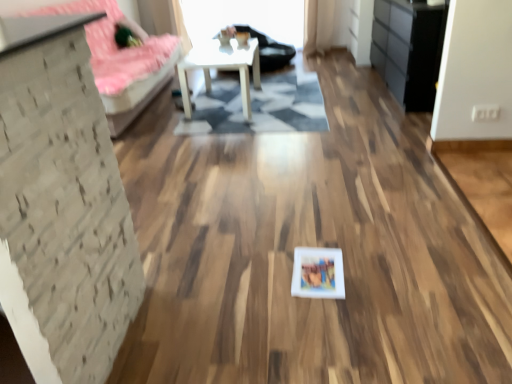
Question: Are geometric rug at center and black matte dresser at right making contact?

Choices:
 (A) yes
 (B) no

Answer: (B)

Question: From the image's perspective, does geometric rug at center appear lower than black matte dresser at right?

Choices:
 (A) yes
 (B) no

Answer: (A)

Question: Considering the relative sizes of geometric rug at center and black matte dresser at right in the image provided, is geometric rug at center taller than black matte dresser at right?

Choices:
 (A) yes
 (B) no

Answer: (B)

Question: Is geometric rug at center looking in the opposite direction of black matte dresser at right?

Choices:
 (A) no
 (B) yes

Answer: (A)

Question: Does geometric rug at center have a greater width compared to black matte dresser at right?

Choices:
 (A) yes
 (B) no

Answer: (A)

Question: Is black matte dresser at right a part of geometric rug at center?

Choices:
 (A) yes
 (B) no

Answer: (B)

Question: Does geometric rug at center appear on the right side of matte white picture frame at center?

Choices:
 (A) no
 (B) yes

Answer: (A)

Question: Can you confirm if geometric rug at center is bigger than matte white picture frame at center?

Choices:
 (A) no
 (B) yes

Answer: (B)

Question: Does geometric rug at center come behind matte white picture frame at center?

Choices:
 (A) yes
 (B) no

Answer: (A)

Question: From a real-world perspective, is geometric rug at center over matte white picture frame at center?

Choices:
 (A) yes
 (B) no

Answer: (A)

Question: Is matte white picture frame at center surrounded by geometric rug at center?

Choices:
 (A) no
 (B) yes

Answer: (A)

Question: Could you tell me if geometric rug at center is facing matte white picture frame at center?

Choices:
 (A) yes
 (B) no

Answer: (B)

Question: Does black matte dresser at right have a greater width compared to matte white picture frame at center?

Choices:
 (A) yes
 (B) no

Answer: (A)